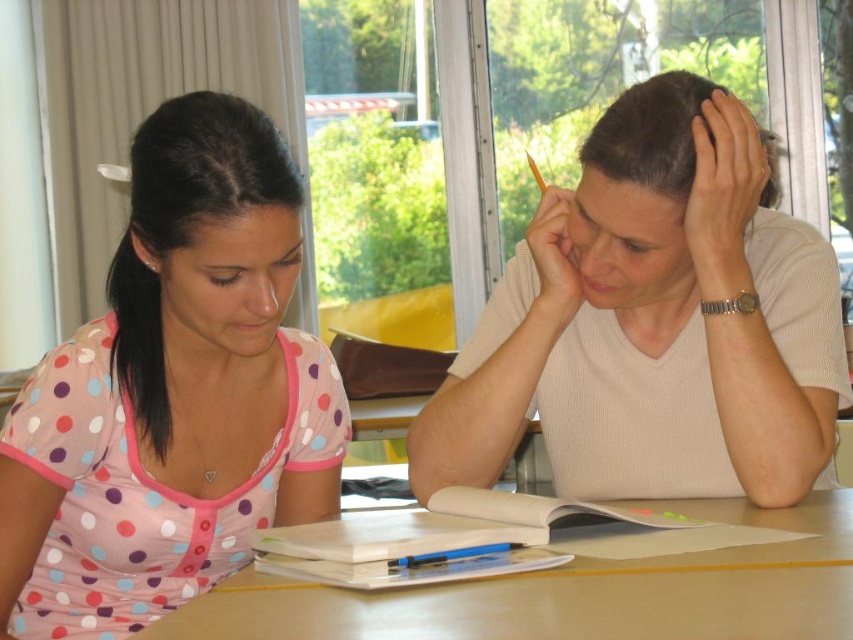
Question: Is pink polka dot shirt at center to the right of pink dotted shirt at left from the viewer's perspective?

Choices:
 (A) no
 (B) yes

Answer: (B)

Question: Does pink polka dot shirt at center have a smaller size compared to pink dotted shirt at left?

Choices:
 (A) no
 (B) yes

Answer: (A)

Question: Among these points, which one is nearest to the camera?

Choices:
 (A) (218, 179)
 (B) (668, 225)
 (C) (688, 312)
 (D) (756, 557)

Answer: (D)

Question: Which point is closer to the camera?

Choices:
 (A) (769, 134)
 (B) (152, 355)

Answer: (B)

Question: Among these points, which one is nearest to the camera?

Choices:
 (A) (709, 96)
 (B) (193, 211)

Answer: (B)

Question: Is white matte shirt at upper right positioned behind wooden table at center?

Choices:
 (A) no
 (B) yes

Answer: (B)